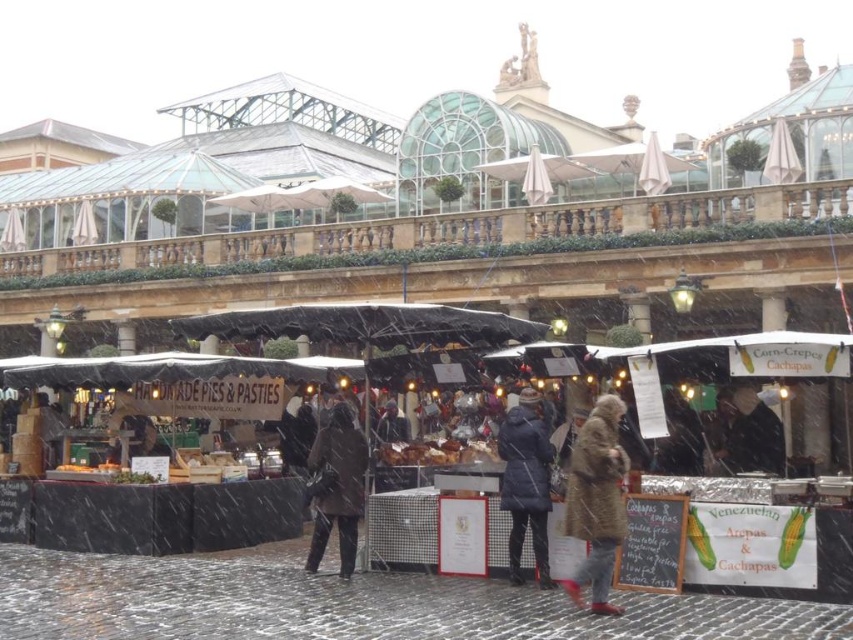
At what (x,y) coordinates should I click in order to perform the action: click on matte black tent at center. Please return your answer as a coordinate pair (x, y). Looking at the image, I should click on (149, 515).

The height and width of the screenshot is (640, 853). Identify the location of matte black tent at center. (149, 515).

I want to click on matte black tent at center, so click(x=149, y=515).

Which is below, matte black tent at center or brown fur coat at center?

brown fur coat at center

Is matte black tent at center smaller than brown fur coat at center?

Actually, matte black tent at center might be larger than brown fur coat at center.

The width and height of the screenshot is (853, 640). In order to click on matte black tent at center in this screenshot , I will do `click(149, 515)`.

Does point (252, 534) come behind point (544, 506)?

Yes, it is behind point (544, 506).

Between matte black tent at center and dark blue fabric coat at center, which one has more height?

matte black tent at center is taller.

Between point (297, 497) and point (529, 422), which one is positioned in front?

Point (529, 422) is in front.

Where is `matte black tent at center`? matte black tent at center is located at coordinates (149, 515).